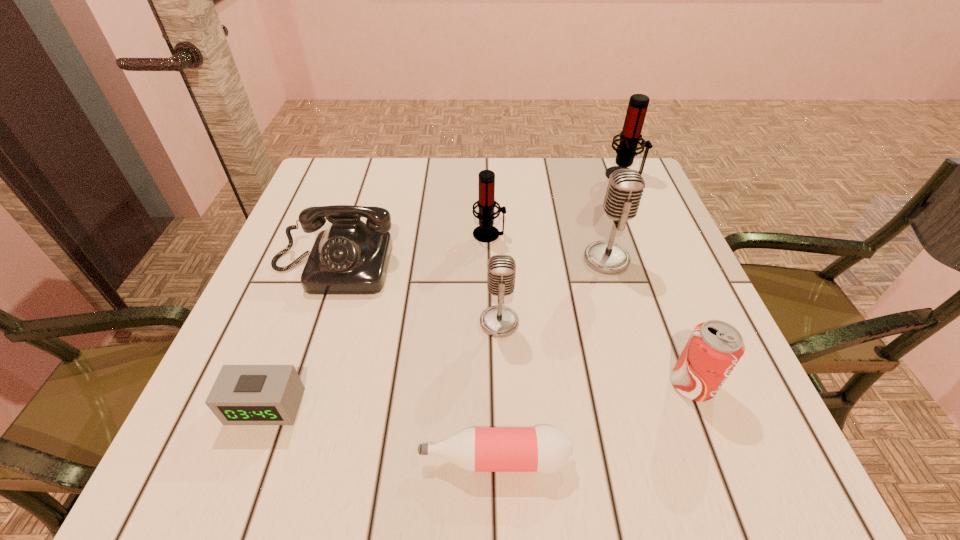
Find the location of a particular element. The height and width of the screenshot is (540, 960). the farthest microphone is located at coordinates (630, 137).

At what (x,y) coordinates should I click in order to perform the action: click on the bigger red microphone. Please return your answer as a coordinate pair (x, y). The width and height of the screenshot is (960, 540). Looking at the image, I should click on (630, 137).

The image size is (960, 540). I want to click on the farther gray microphone, so click(625, 188).

The image size is (960, 540). I want to click on the bigger gray microphone, so click(625, 188).

Identify the location of the nearer red microphone. This screenshot has width=960, height=540. (485, 232).

Find the location of a particular element. the smaller red microphone is located at coordinates (485, 232).

Where is `the left gray microphone`? The width and height of the screenshot is (960, 540). the left gray microphone is located at coordinates (499, 321).

You are a GUI agent. You are given a task and a screenshot of the screen. Output one action in this format:
    pyautogui.click(x=<x>, y=<y>)
    Task: Click on the nearest microphone
    
    Given the screenshot: What is the action you would take?
    pyautogui.click(x=499, y=321)

In order to click on pink soda can in this screenshot , I will do `click(714, 348)`.

I want to click on telephone, so click(x=350, y=258).